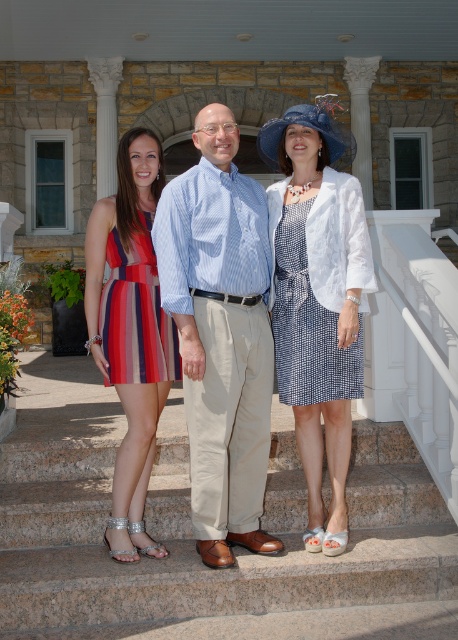
You are standing on the stone steps in front of the classical building. You want to greet the person wearing the blue houndstooth dress at center and the person in the striped cotton dress at left. Which person should you approach first to reach them in the shortest distance?

You should approach the blue houndstooth dress at center first because it is closer to you than the striped cotton dress at left, so you can reach them in the shortest distance.

You are standing at the point marked as point (310, 374) in the image. The building has a white railing on the right side leading up to the entrance. If you want to walk towards the entrance, which direction should you turn?

You should turn towards the right side since the white railing is on the right, indicating the entrance direction.